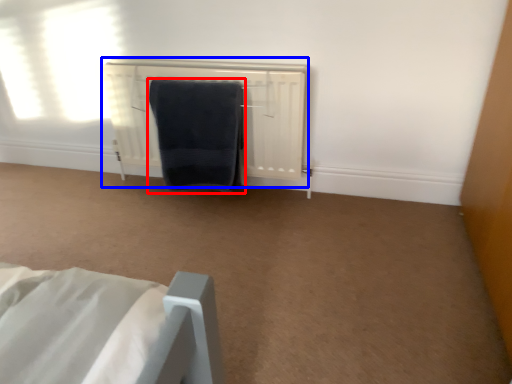
Question: Which object appears closest to the camera in this image, towel (highlighted by a red box) or radiator (highlighted by a blue box)?

Choices:
 (A) towel
 (B) radiator

Answer: (A)